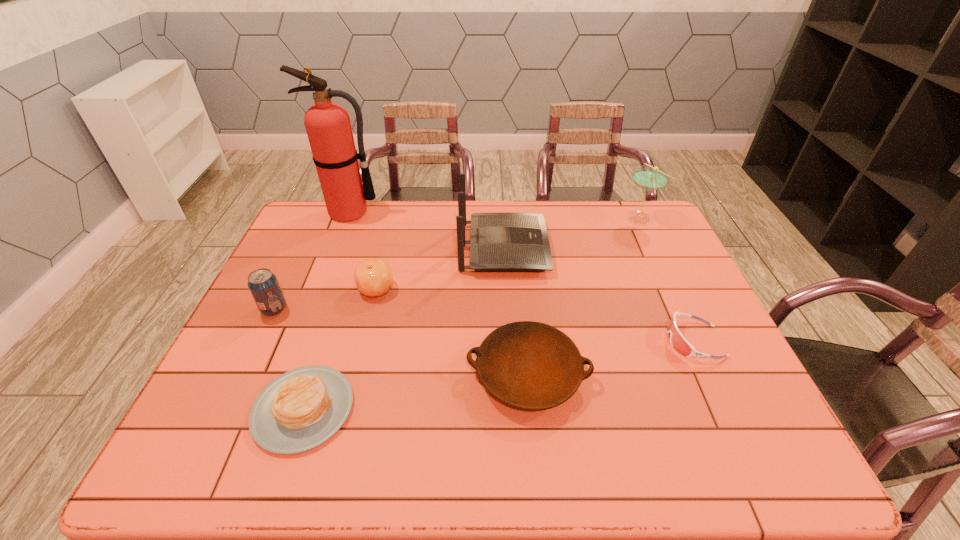
In the image, there is a desktop. Identify the location of vacant space at the far edge. (404, 229).

Locate an element on the screen. The height and width of the screenshot is (540, 960). vacant space at the near edge of the desktop is located at coordinates (662, 469).

Identify the location of free space at the left edge. The image size is (960, 540). (204, 396).

In the image, there is a desktop. Identify the location of free space at the right edge. (660, 284).

In the image, there is a desktop. Where is `vacant space at the far left corner`? This screenshot has height=540, width=960. vacant space at the far left corner is located at coordinates (299, 227).

This screenshot has height=540, width=960. I want to click on vacant space at the far right corner of the desktop, so click(656, 219).

Locate an element on the screen. The height and width of the screenshot is (540, 960). free spot between the pop soda and the goggles is located at coordinates (484, 325).

I want to click on free space that is in between the fourth tallest object and the plate, so click(401, 342).

This screenshot has width=960, height=540. What are the coordinates of `free space between the martini and the plate` in the screenshot? It's located at (584, 296).

Locate an element on the screen. The width and height of the screenshot is (960, 540). free space between the goggles and the pop soda is located at coordinates (484, 325).